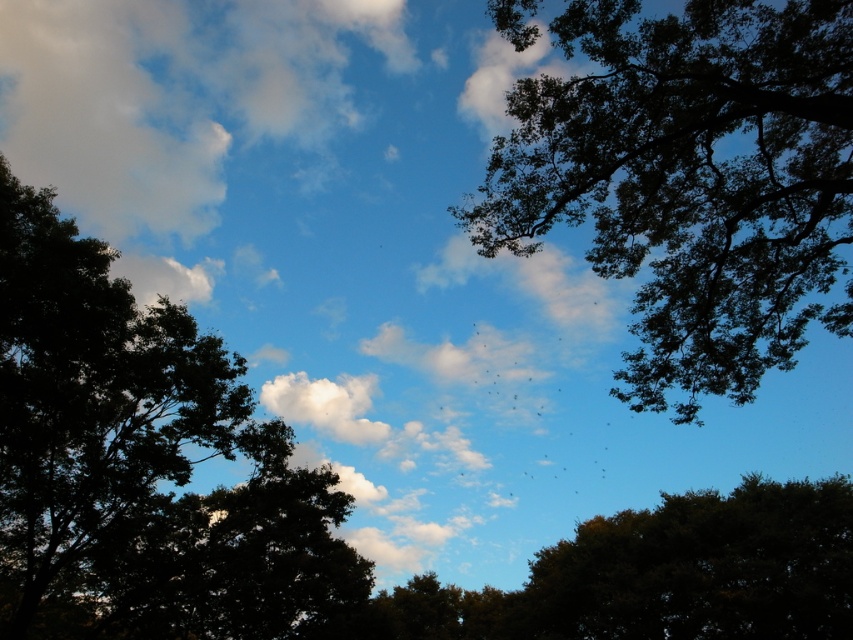
Question: Estimate the real-world distances between objects in this image. Which object is closer to the dark green leafy tree at upper right?

Choices:
 (A) green leafy tree at center
 (B) dark green leafy tree at upper left

Answer: (B)

Question: Is dark green leafy tree at upper left to the left of green leafy tree at center from the viewer's perspective?

Choices:
 (A) yes
 (B) no

Answer: (A)

Question: Which point is farther from the camera taking this photo?

Choices:
 (A) (552, 579)
 (B) (93, 561)
 (C) (630, 160)

Answer: (A)

Question: Is dark green leafy tree at upper right thinner than dark green leafy tree at upper left?

Choices:
 (A) yes
 (B) no

Answer: (B)

Question: Observing the image, what is the correct spatial positioning of dark green leafy tree at upper right in reference to green leafy tree at center?

Choices:
 (A) above
 (B) below

Answer: (A)

Question: Which of the following is the closest to the observer?

Choices:
 (A) dark green leafy tree at upper right
 (B) green leafy tree at center

Answer: (A)